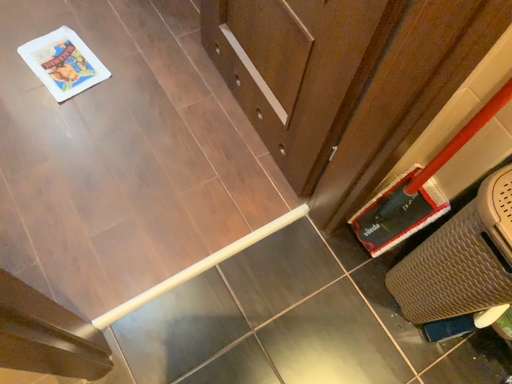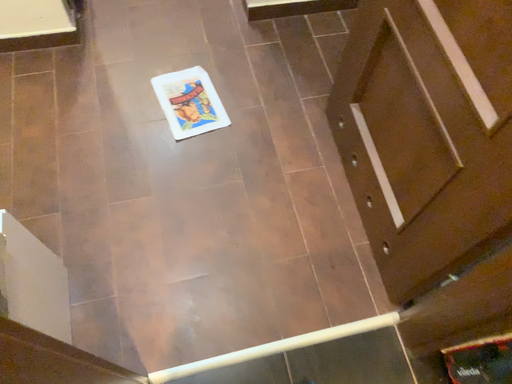
Question: How did the camera likely rotate when shooting the video?

Choices:
 (A) rotated left
 (B) rotated right

Answer: (A)